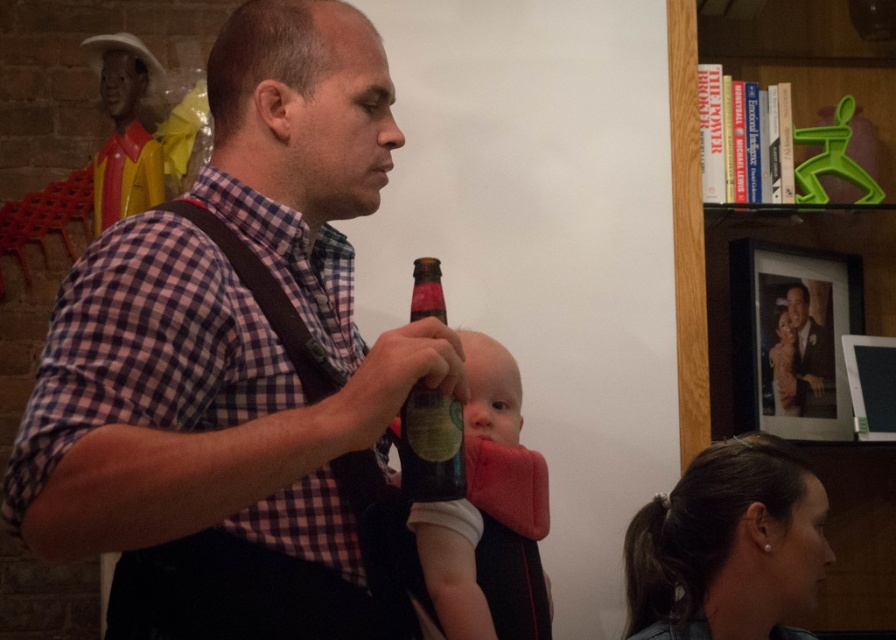
Question: Which object is closer to the camera taking this photo?

Choices:
 (A) brown leather suspenders at left
 (B) green plastic figure at upper right
 (C) formal suit at upper right

Answer: (A)

Question: Does matte plaid shirt at center appear on the right side of green plastic figure at upper right?

Choices:
 (A) no
 (B) yes

Answer: (A)

Question: Is the position of brown leather suspenders at left less distant than that of formal suit at upper right?

Choices:
 (A) no
 (B) yes

Answer: (B)

Question: Which object is the closest to the brown leather suspenders at left?

Choices:
 (A) smooth plastic bottle at center
 (B) green glass bottle at center

Answer: (B)

Question: Does green plastic figure at upper right have a greater width compared to dark brown hair at lower right?

Choices:
 (A) yes
 (B) no

Answer: (A)

Question: Among these objects, which one is nearest to the camera?

Choices:
 (A) smooth plastic bottle at center
 (B) brown leather suspenders at left
 (C) formal suit at upper right
 (D) green glass bottle at center

Answer: (B)